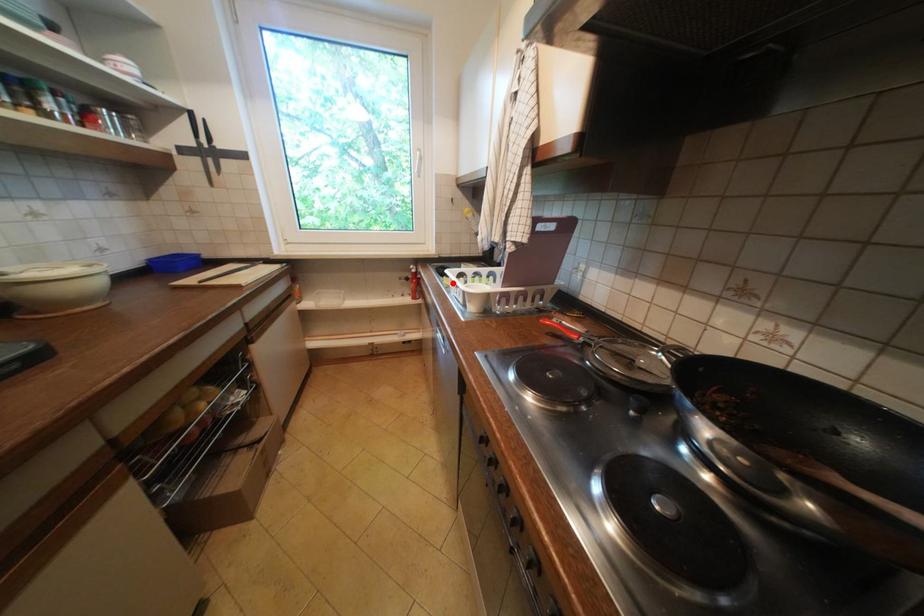
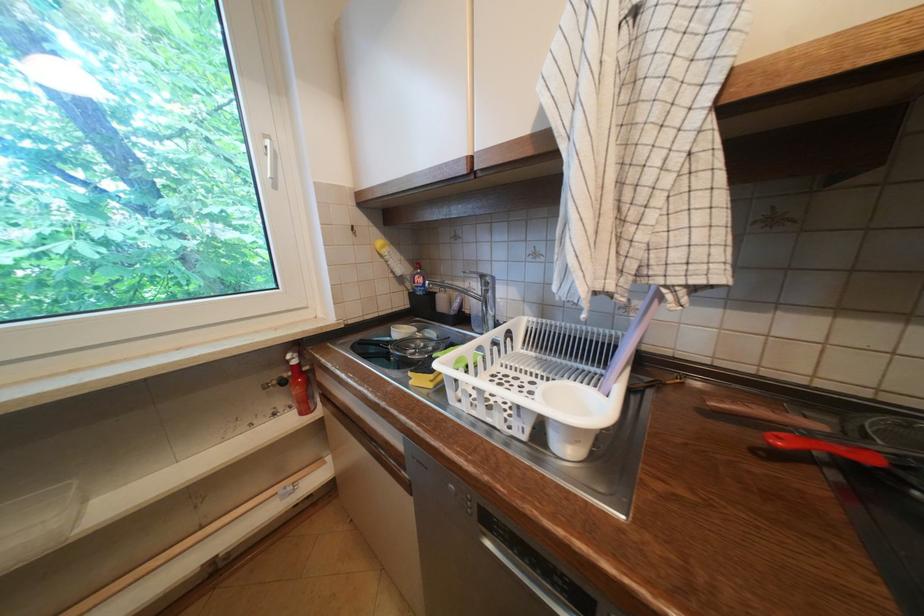
Find the pixel in the second image that matches the highlighted location in the first image.

(419, 383)